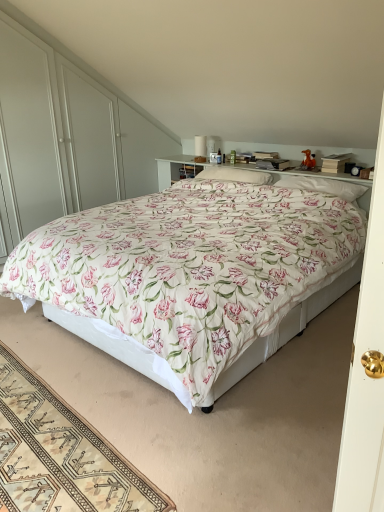
This screenshot has height=512, width=384. What are the coordinates of `free spot above beige woven rug at lower left (from a real-world perspective)` in the screenshot? It's located at (48, 431).